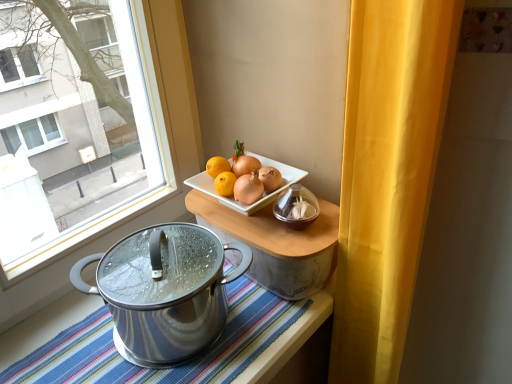
Question: In the image, is striped fabric tablecloth at lower center positioned in front of or behind wooden tray at center?

Choices:
 (A) front
 (B) behind

Answer: (A)

Question: Is striped fabric tablecloth at lower center inside the boundaries of wooden tray at center, or outside?

Choices:
 (A) outside
 (B) inside

Answer: (A)

Question: Estimate the real-world distances between objects in this image. Which object is closer to the striped fabric tablecloth at lower center?

Choices:
 (A) polished stainless steel pot at lower left
 (B) yellow fabric curtain at right
 (C) wooden tray at center

Answer: (C)

Question: Which object is the farthest from the striped fabric tablecloth at lower center?

Choices:
 (A) yellow fabric curtain at right
 (B) wooden tray at center
 (C) polished stainless steel pot at lower left

Answer: (C)